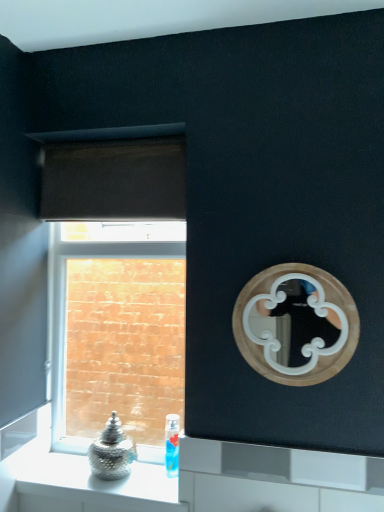
At what (x,y) coordinates should I click in order to perform the action: click on vacant region in front of translucent plastic bottle at lower center. Please return your answer as a coordinate pair (x, y). The height and width of the screenshot is (512, 384). Looking at the image, I should click on (161, 489).